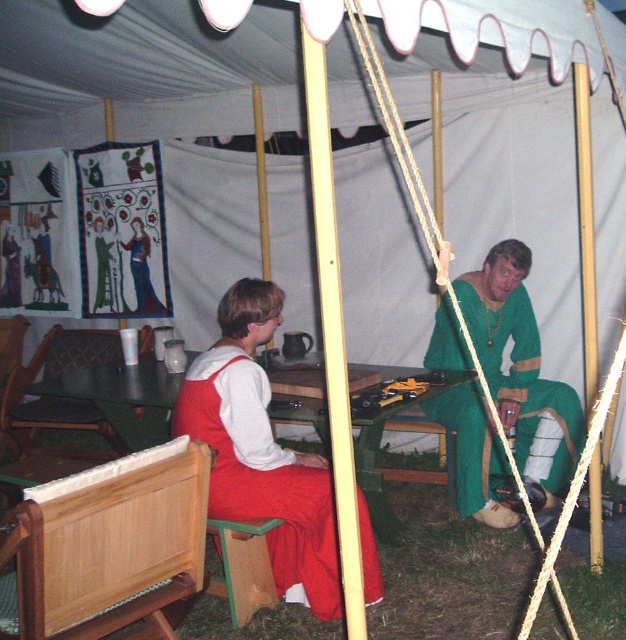
Question: Which of the following is the farthest from the observer?

Choices:
 (A) green fabric dress at center
 (B) wooden table at center

Answer: (A)

Question: Can you confirm if wooden chair at center is positioned to the right of wooden textured chair at center?

Choices:
 (A) yes
 (B) no

Answer: (A)

Question: Is wooden table at center positioned behind wooden textured chair at center?

Choices:
 (A) yes
 (B) no

Answer: (B)

Question: Which of the following is the farthest from the observer?

Choices:
 (A) green fabric dress at center
 (B) wooden chair at center
 (C) wooden table at center
 (D) wooden textured chair at center

Answer: (D)

Question: Can you confirm if green fabric dress at center is positioned below wooden table at center?

Choices:
 (A) no
 (B) yes

Answer: (A)

Question: Which of the following is the closest to the observer?

Choices:
 (A) (572, 416)
 (B) (43, 364)
 (C) (21, 525)

Answer: (C)